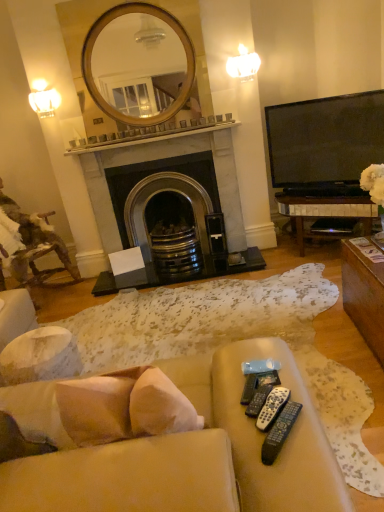
The image size is (384, 512). Identify the location of matte white lampshade at upper left, the second light fixture in the top-to-bottom sequence. (43, 99).

How much space does black plastic remote controls at lower right, arranged as the 1th remote control when viewed from the front, occupy vertically?

The height of black plastic remote controls at lower right, arranged as the 1th remote control when viewed from the front, is 1.30 inches.

Find the location of a particular element. The image size is (384, 512). black marble fireplace at center is located at coordinates (165, 190).

Locate an element on the screen. The height and width of the screenshot is (512, 384). white marble fireplace at center is located at coordinates (151, 138).

Measure the distance between beige fabric couch at lower center and camera.

A distance of 94.03 centimeters exists between beige fabric couch at lower center and camera.

This screenshot has height=512, width=384. What are the coordinates of `white plastic remote controls at lower right, which is counted as the second remote control, starting from the front` in the screenshot? It's located at (272, 407).

Who is taller, black plastic remote controls at lower right, placed as the fourth remote control when sorted from back to front, or white plastic remote controls at lower right, which is counted as the 3th remote control, starting from the back?

black plastic remote controls at lower right, placed as the fourth remote control when sorted from back to front, is taller.

Are black plastic remote controls at lower right, arranged as the 1th remote control when viewed from the front, and white plastic remote controls at lower right, which is counted as the second remote control, starting from the front, far apart?

No, black plastic remote controls at lower right, arranged as the 1th remote control when viewed from the front, is in close proximity to white plastic remote controls at lower right, which is counted as the second remote control, starting from the front.

What's the angular difference between black plastic remote controls at lower right, placed as the fourth remote control when sorted from back to front, and white plastic remote controls at lower right, which is counted as the second remote control, starting from the front,'s facing directions?

black plastic remote controls at lower right, placed as the fourth remote control when sorted from back to front, and white plastic remote controls at lower right, which is counted as the second remote control, starting from the front, are facing 0.00381 degrees away from each other.

Considering the relative positions of black plastic remote controls at lower right, arranged as the 1th remote control when viewed from the front, and white plastic remote controls at lower right, which is counted as the second remote control, starting from the front, in the image provided, is black plastic remote controls at lower right, arranged as the 1th remote control when viewed from the front, to the left of white plastic remote controls at lower right, which is counted as the second remote control, starting from the front, from the viewer's perspective?

No.

Is white frosted glass sconce at upper right, which is the 2th light fixture in bottom-to-top order, wider or thinner than black marble fireplace at center?

In the image, white frosted glass sconce at upper right, which is the 2th light fixture in bottom-to-top order, appears to be more narrow than black marble fireplace at center.

Between point (233, 57) and point (195, 132), which one is positioned in front?

The point (233, 57) is more forward.

From a real-world perspective, is white frosted glass sconce at upper right, which is the 2th light fixture in bottom-to-top order, positioned under black marble fireplace at center based on gravity?

Actually, white frosted glass sconce at upper right, which is the 2th light fixture in bottom-to-top order, is physically above black marble fireplace at center in the real world.

Who is smaller, white frosted glass sconce at upper right, which is the 2th light fixture in bottom-to-top order, or black marble fireplace at center?

white frosted glass sconce at upper right, which is the 2th light fixture in bottom-to-top order, is smaller.

Is matte white lampshade at upper left, the 1th light fixture when ordered from bottom to top, taller or shorter than white plastic remote controls at lower right, which is counted as the second remote control, starting from the front?

matte white lampshade at upper left, the 1th light fixture when ordered from bottom to top, is taller than white plastic remote controls at lower right, which is counted as the second remote control, starting from the front.

How different are the orientations of matte white lampshade at upper left, the 1th light fixture when ordered from bottom to top, and white plastic remote controls at lower right, which is counted as the second remote control, starting from the front, in degrees?

The angle between the facing direction of matte white lampshade at upper left, the 1th light fixture when ordered from bottom to top, and the facing direction of white plastic remote controls at lower right, which is counted as the second remote control, starting from the front, is 144 degrees.

Is matte white lampshade at upper left, which is the second light fixture in right-to-left order, in front of or behind white plastic remote controls at lower right, which is counted as the 3th remote control, starting from the back, in the image?

matte white lampshade at upper left, which is the second light fixture in right-to-left order, is behind white plastic remote controls at lower right, which is counted as the 3th remote control, starting from the back.

Considering the positions of objects camouflage fabric chair at left and beige fabric couch at lower center in the image provided, who is more to the left, camouflage fabric chair at left or beige fabric couch at lower center?

camouflage fabric chair at left is more to the left.

Can you confirm if camouflage fabric chair at left is bigger than beige fabric couch at lower center?

Incorrect, camouflage fabric chair at left is not larger than beige fabric couch at lower center.

From the image's perspective, is camouflage fabric chair at left located above beige fabric couch at lower center?

Correct, camouflage fabric chair at left appears higher than beige fabric couch at lower center in the image.

From the picture: Is the surface of black marble fireplace at center in direct contact with beige fabric couch at lower center?

black marble fireplace at center and beige fabric couch at lower center are not in contact.

Which of these two, black marble fireplace at center or beige fabric couch at lower center, stands taller?

black marble fireplace at center.

Which is more to the left, black marble fireplace at center or beige fabric couch at lower center?

From the viewer's perspective, beige fabric couch at lower center appears more on the left side.

From the image's perspective, who appears lower, black marble fireplace at center or beige fabric couch at lower center?

beige fabric couch at lower center.

Can you confirm if beige fabric couch at lower center is shorter than white plastic remote controls at lower right, which is counted as the second remote control, starting from the front?

No.

From a real-world perspective, is beige fabric couch at lower center above or below white plastic remote controls at lower right, which is counted as the second remote control, starting from the front?

beige fabric couch at lower center is below white plastic remote controls at lower right, which is counted as the second remote control, starting from the front.

Is beige fabric couch at lower center not within white plastic remote controls at lower right, which is counted as the second remote control, starting from the front?

That's correct, beige fabric couch at lower center is outside of white plastic remote controls at lower right, which is counted as the second remote control, starting from the front.

Considering the positions of objects black plastic remote controls at lower right, placed as the fourth remote control when sorted from back to front, and matte white lampshade at upper left, the 1th light fixture when ordered from bottom to top, in the image provided, who is more to the right, black plastic remote controls at lower right, placed as the fourth remote control when sorted from back to front, or matte white lampshade at upper left, the 1th light fixture when ordered from bottom to top,?

Positioned to the right is black plastic remote controls at lower right, placed as the fourth remote control when sorted from back to front.

Between black plastic remote controls at lower right, placed as the fourth remote control when sorted from back to front, and matte white lampshade at upper left, the second light fixture in the top-to-bottom sequence, which one is positioned behind?

matte white lampshade at upper left, the second light fixture in the top-to-bottom sequence, is further away from the camera.

In order to click on remote control in front of the white plastic remote controls at lower right, which is counted as the second remote control, starting from the front in this screenshot , I will do `click(279, 432)`.

The image size is (384, 512). Identify the location of light fixture on the right of black marble fireplace at center. (243, 64).

Based on the photo, from the image, which object appears to be nearer to white frosted glass sconce at upper right, which is the 2th light fixture in bottom-to-top order, beige fabric couch at lower center or black plastic remote control at lower center, the second remote control in the back-to-front sequence?

The object closer to white frosted glass sconce at upper right, which is the 2th light fixture in bottom-to-top order, is black plastic remote control at lower center, the second remote control in the back-to-front sequence.

When comparing their distances from black marble fireplace at center, does white plastic remote controls at lower right, which is counted as the second remote control, starting from the front, or matte white lampshade at upper left, the 1th light fixture when ordered from bottom to top, seem further?

white plastic remote controls at lower right, which is counted as the second remote control, starting from the front, is further to black marble fireplace at center.

Based on their spatial positions, is camouflage fabric chair at left or black plastic remote controls at lower right, arranged as the 1th remote control when viewed from the front, further from black plastic remote control at lower center, the second remote control in the back-to-front sequence?

camouflage fabric chair at left is further to black plastic remote control at lower center, the second remote control in the back-to-front sequence.

Based on their spatial positions, is white marble fireplace at center or beige fabric couch at lower center further from black plastic remote control at lower center, marked as the fourth remote control in a front-to-back arrangement?

Among the two, white marble fireplace at center is located further to black plastic remote control at lower center, marked as the fourth remote control in a front-to-back arrangement.

Which object lies nearer to the anchor point black marble fireplace at center, white plastic remote controls at lower right, which is counted as the second remote control, starting from the front, or camouflage fabric chair at left?

Based on the image, camouflage fabric chair at left appears to be nearer to black marble fireplace at center.

Based on the photo, looking at the image, which one is located closer to white marble fireplace at center, matte white lampshade at upper left, arranged as the first light fixture when viewed from the left, or black plastic remote control at lower center, the second remote control in the back-to-front sequence?

matte white lampshade at upper left, arranged as the first light fixture when viewed from the left, lies closer to white marble fireplace at center than the other object.

Looking at this image, when comparing their distances from white marble fireplace at center, does black marble fireplace at center or black plastic remote controls at lower right, arranged as the 1th remote control when viewed from the front, seem closer?

Among the two, black marble fireplace at center is located nearer to white marble fireplace at center.

Based on their spatial positions, is beige fabric couch at lower center or black plastic remote control at lower center, the second remote control in the back-to-front sequence, closer to white marble fireplace at center?

The object closer to white marble fireplace at center is black plastic remote control at lower center, the second remote control in the back-to-front sequence.

Image resolution: width=384 pixels, height=512 pixels. What are the coordinates of `chair between black plastic remote controls at lower right, placed as the fourth remote control when sorted from back to front, and matte white lampshade at upper left, the 1th light fixture when ordered from bottom to top, in the front-back direction` in the screenshot? It's located at 36,231.

At what (x,y) coordinates should I click in order to perform the action: click on mantle located between beige fabric couch at lower center and black marble fireplace at center in the depth direction. Please return your answer as a coordinate pair (x, y). The image size is (384, 512). Looking at the image, I should click on (151, 138).

Identify the location of chair located between beige fabric couch at lower center and white frosted glass sconce at upper right, which appears as the 1th light fixture when viewed from the top, in the depth direction. (36, 231).

I want to click on fireplace between camouflage fabric chair at left and white frosted glass sconce at upper right, which is the 2th light fixture in bottom-to-top order, from left to right, so pyautogui.click(x=165, y=190).